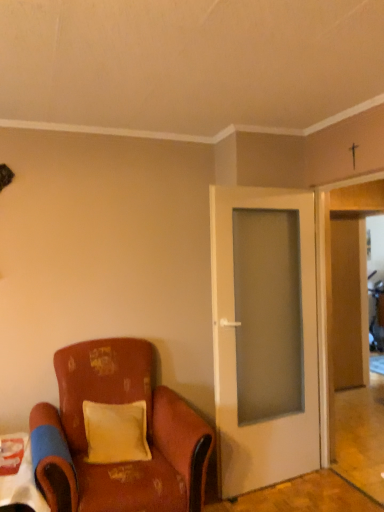
Question: Is the depth of white glossy table at lower left less than that of white glass door at center?

Choices:
 (A) no
 (B) yes

Answer: (B)

Question: Can you confirm if white glossy table at lower left is positioned to the right of white glass door at center?

Choices:
 (A) no
 (B) yes

Answer: (A)

Question: Can you confirm if white glossy table at lower left is bigger than white glass door at center?

Choices:
 (A) no
 (B) yes

Answer: (A)

Question: Is the position of white glossy table at lower left more distant than that of white glass door at center?

Choices:
 (A) yes
 (B) no

Answer: (B)

Question: Is white glossy table at lower left in contact with white glass door at center?

Choices:
 (A) yes
 (B) no

Answer: (B)

Question: From a real-world perspective, is white glossy table at lower left over white glass door at center?

Choices:
 (A) yes
 (B) no

Answer: (B)

Question: Is yellow velvet pillow at center looking in the opposite direction of white glass door at center?

Choices:
 (A) no
 (B) yes

Answer: (A)

Question: From a real-world perspective, is yellow velvet pillow at center located beneath white glass door at center?

Choices:
 (A) yes
 (B) no

Answer: (A)

Question: Is yellow velvet pillow at center aimed at white glass door at center?

Choices:
 (A) yes
 (B) no

Answer: (B)

Question: Is white glass door at center surrounded by yellow velvet pillow at center?

Choices:
 (A) yes
 (B) no

Answer: (B)

Question: Does yellow velvet pillow at center appear on the left side of white glass door at center?

Choices:
 (A) no
 (B) yes

Answer: (B)

Question: Is yellow velvet pillow at center located outside white glass door at center?

Choices:
 (A) no
 (B) yes

Answer: (B)

Question: Considering the relative positions of white glass door at center and wooden door at right in the image provided, is white glass door at center to the right of wooden door at right from the viewer's perspective?

Choices:
 (A) no
 (B) yes

Answer: (A)